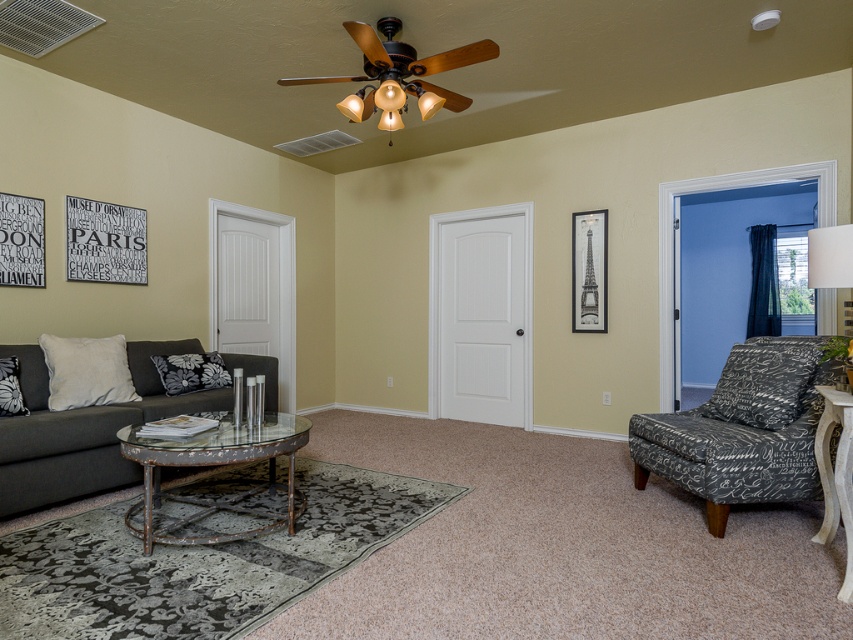
Is point (155, 488) positioned after point (846, 404)?

Yes.

Consider the image. Which of these two, rustic metal coffee table at center or white wood side table at lower right, stands shorter?

Standing shorter between the two is rustic metal coffee table at center.

Is point (239, 509) positioned before point (850, 406)?

No, (239, 509) is further to viewer.

Where is `rustic metal coffee table at center`? Image resolution: width=853 pixels, height=640 pixels. rustic metal coffee table at center is located at coordinates click(212, 470).

Can you confirm if dark gray fabric armchair at right is thinner than white fabric lampshade at upper right?

Incorrect, dark gray fabric armchair at right's width is not less than white fabric lampshade at upper right's.

Between point (737, 401) and point (848, 273), which one is positioned in front?

Point (848, 273) is more forward.

This screenshot has width=853, height=640. What do you see at coordinates (741, 429) in the screenshot?
I see `dark gray fabric armchair at right` at bounding box center [741, 429].

Where is `dark gray fabric armchair at right`? The width and height of the screenshot is (853, 640). dark gray fabric armchair at right is located at coordinates (741, 429).

Is dark gray fabric couch at left to the right of white fabric lampshade at upper right from the viewer's perspective?

No, dark gray fabric couch at left is not to the right of white fabric lampshade at upper right.

Locate an element on the screen. The width and height of the screenshot is (853, 640). dark gray fabric couch at left is located at coordinates (83, 429).